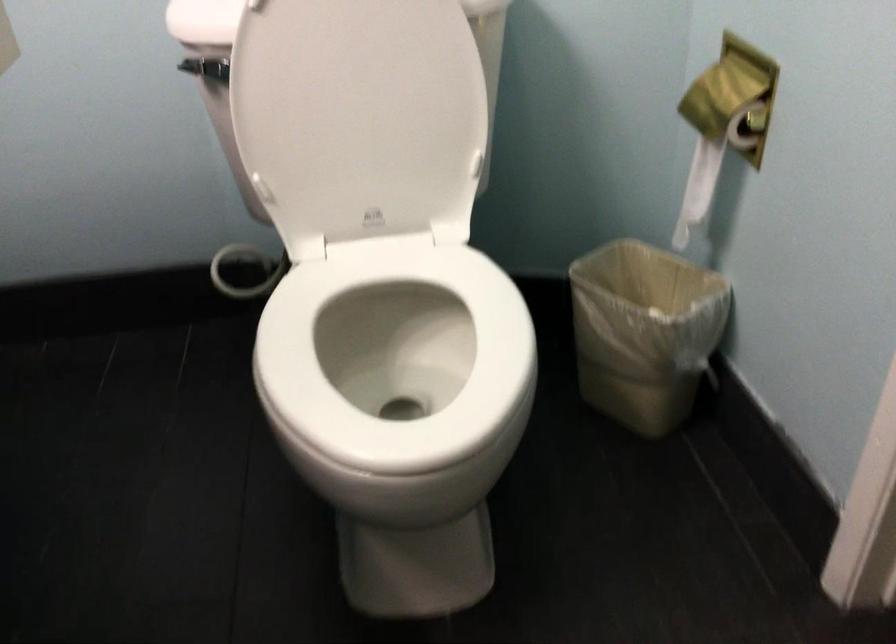
Find where to lift the white toilet seat. Please return your answer as a coordinate pair (x, y).

(395, 359)